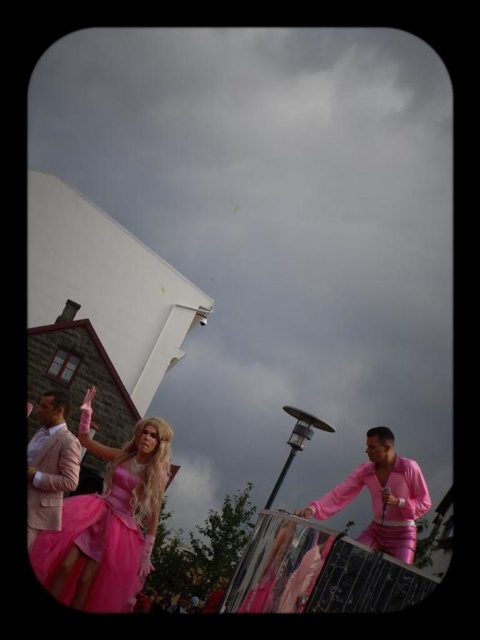
Does pink satin dress at lower center have a smaller size compared to matte pink suit at left?

No.

Does pink satin dress at lower center come behind matte pink suit at left?

No, it is not.

Identify the location of pink satin dress at lower center. This screenshot has width=480, height=640. (382, 497).

Between shiny pink dress at lower left and matte pink suit at left, which one has more height?

Standing taller between the two is matte pink suit at left.

Does point (80, 545) come closer to viewer compared to point (61, 426)?

Yes, it is in front of point (61, 426).

Who is more distant from viewer, (113, 477) or (28, 476)?

The point (113, 477) is behind.

I want to click on shiny pink dress at lower left, so click(x=96, y=547).

Which is more to the right, shiny pink dress at lower left or pink satin dress at lower center?

From the viewer's perspective, pink satin dress at lower center appears more on the right side.

The width and height of the screenshot is (480, 640). Describe the element at coordinates (96, 547) in the screenshot. I see `shiny pink dress at lower left` at that location.

Locate an element on the screen. This screenshot has width=480, height=640. shiny pink dress at lower left is located at coordinates (96, 547).